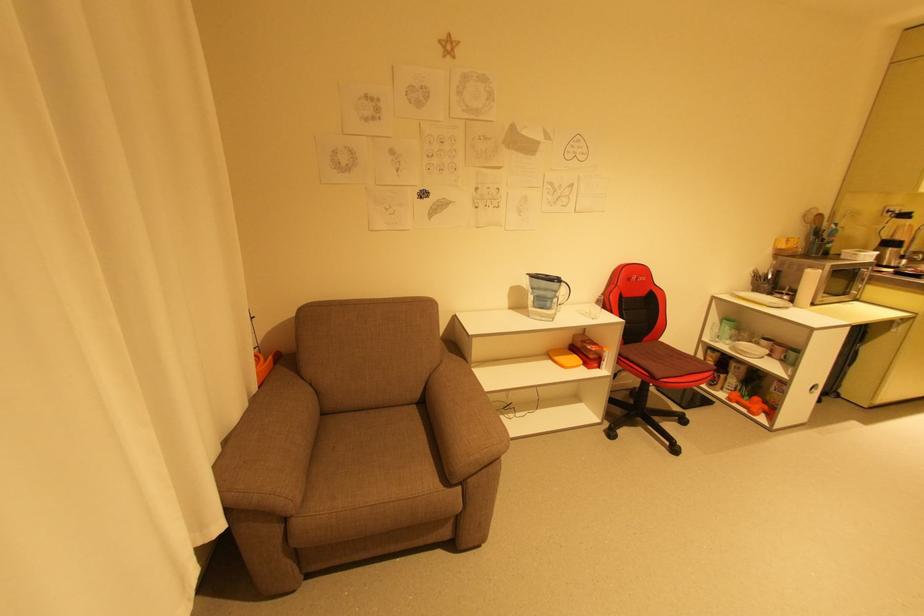
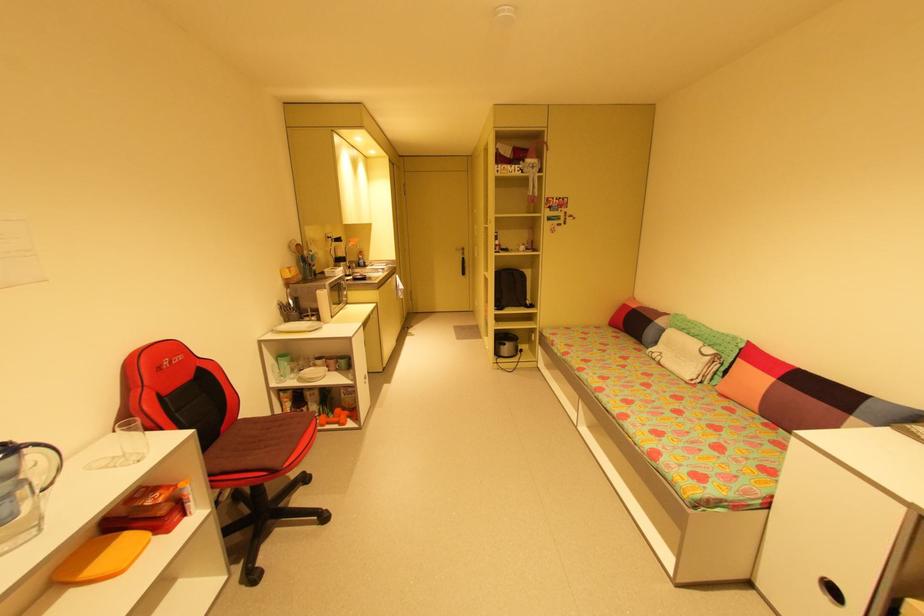
The point at (757, 410) is marked in the first image. Where is the corresponding point in the second image?

(345, 422)